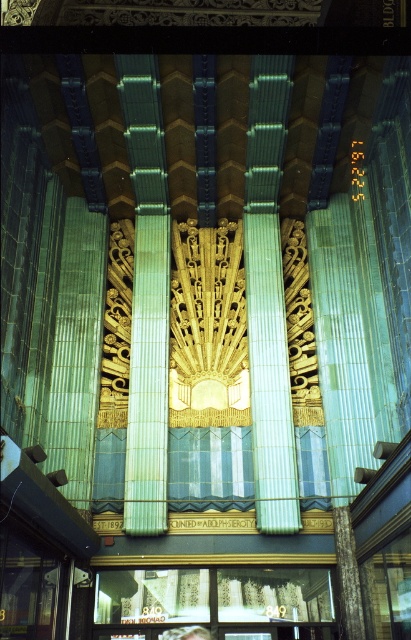
Does white textured curtains at lower center have a lesser height compared to light brown hair at lower center?

No.

Is point (99, 589) positioned before point (164, 634)?

No, (99, 589) is behind (164, 634).

I want to click on white textured curtains at lower center, so click(219, 598).

Locate an element on the screen. white textured curtains at lower center is located at coordinates pyautogui.click(x=219, y=598).